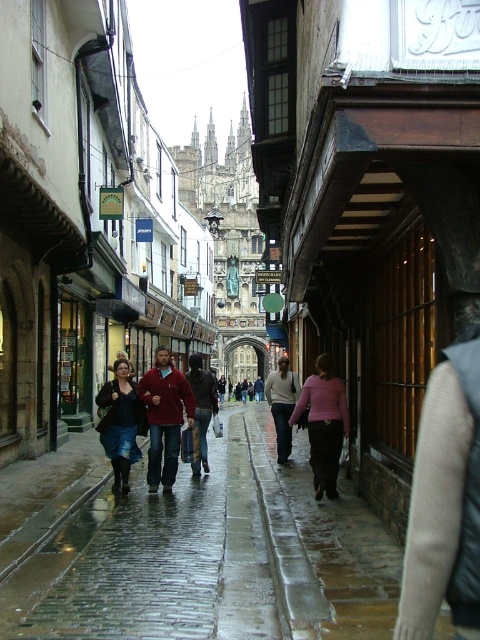
Who is positioned more to the right, light beige sweater at center or dark brown leather jacket at center?

Positioned to the right is light beige sweater at center.

The image size is (480, 640). What do you see at coordinates (282, 404) in the screenshot?
I see `light beige sweater at center` at bounding box center [282, 404].

Where is `light beige sweater at center`? light beige sweater at center is located at coordinates (282, 404).

Can you confirm if blue denim skirt at center is positioned to the left of dark brown leather jacket at center?

Yes, blue denim skirt at center is to the left of dark brown leather jacket at center.

Does blue denim skirt at center appear on the right side of dark brown leather jacket at center?

No, blue denim skirt at center is not to the right of dark brown leather jacket at center.

Which is behind, point (136, 426) or point (201, 449)?

Point (201, 449)

Where is `blue denim skirt at center`? Image resolution: width=480 pixels, height=640 pixels. blue denim skirt at center is located at coordinates (120, 422).

From the picture: Between pink matte sweater at center and dark brown leather jacket at center, which one has less height?

dark brown leather jacket at center

Who is lower down, pink matte sweater at center or dark brown leather jacket at center?

pink matte sweater at center is below.

Is point (322, 452) farther from viewer compared to point (205, 396)?

That is False.

This screenshot has width=480, height=640. I want to click on pink matte sweater at center, so click(x=324, y=424).